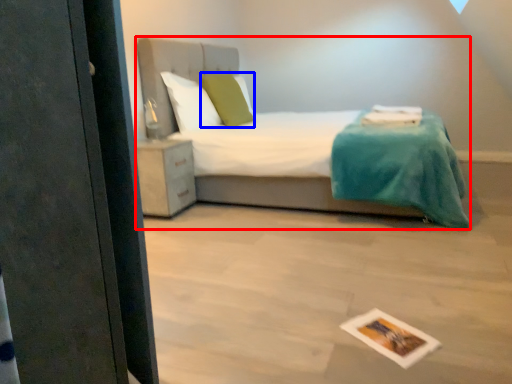
Question: Among these objects, which one is nearest to the camera, bed (highlighted by a red box) or pillow (highlighted by a blue box)?

Choices:
 (A) bed
 (B) pillow

Answer: (A)